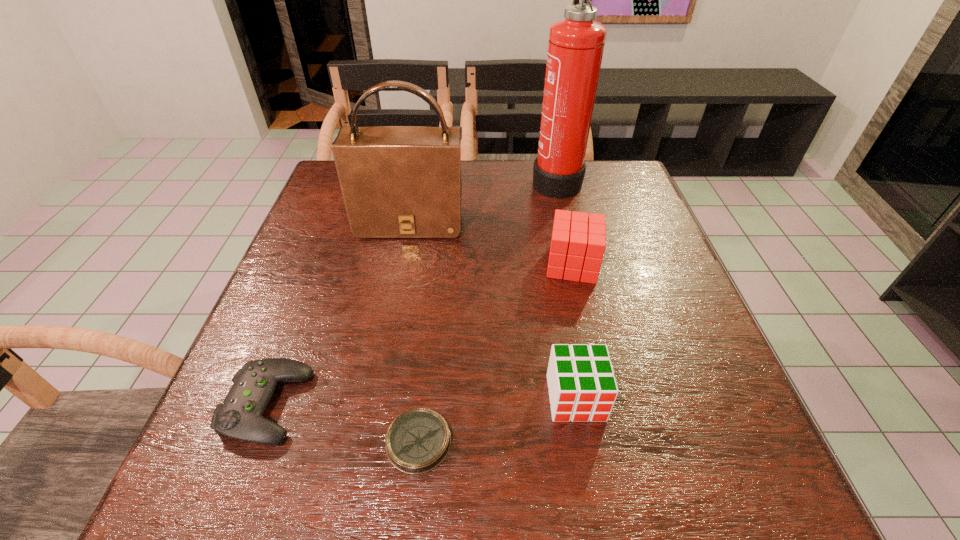
Locate an element on the screen. Image resolution: width=960 pixels, height=540 pixels. free space that satisfies the following two spatial constraints: 1. on the front flap of the second farthest object; 2. on the left side of the shortest object is located at coordinates pyautogui.click(x=369, y=442).

Identify the location of vacant position in the image that satisfies the following two spatial constraints: 1. on the front-facing side of the tallest object; 2. on the front flap of the second tallest object. (565, 224).

At what (x,y) coordinates should I click in order to perform the action: click on vacant space that satisfies the following two spatial constraints: 1. on the front side of the control; 2. on the left side of the compass. Please return your answer as a coordinate pair (x, y). The width and height of the screenshot is (960, 540). Looking at the image, I should click on (252, 442).